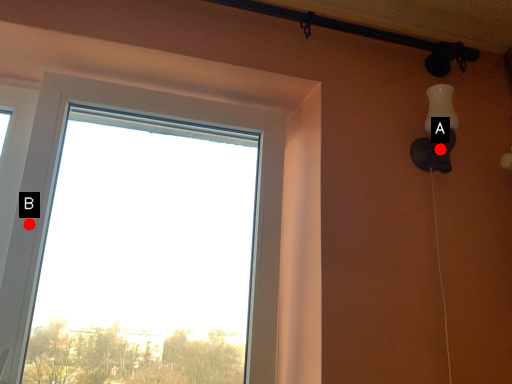
Question: Two points are circled on the image, labeled by A and B beside each circle. Which point is closer to the camera?

Choices:
 (A) A is closer
 (B) B is closer

Answer: (B)